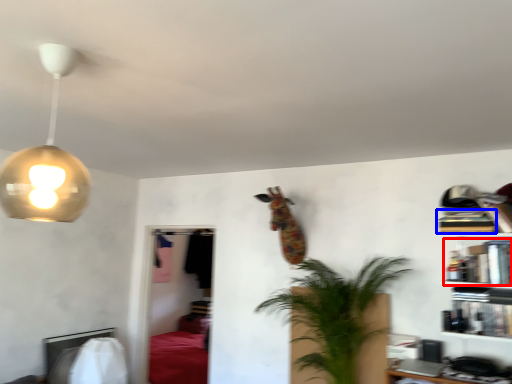
Question: Which object appears farthest to the camera in this image, book (highlighted by a red box) or book (highlighted by a blue box)?

Choices:
 (A) book
 (B) book

Answer: (B)